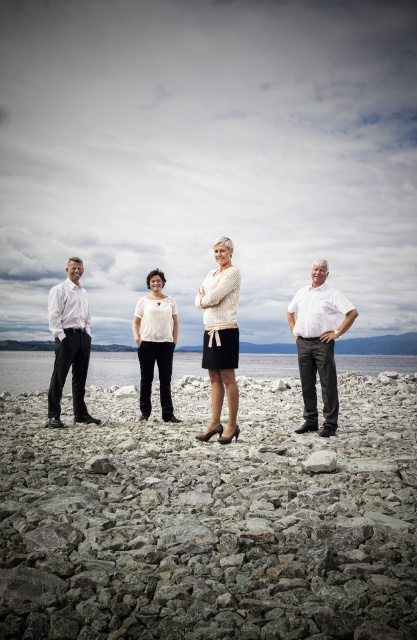
In the scene shown: Between gray gravel at center and white matte shirt at right, which one is positioned higher?

Positioned higher is white matte shirt at right.

Is point (160, 524) closer to viewer compared to point (293, 314)?

That is True.

Identify the location of gray gravel at center. Image resolution: width=417 pixels, height=640 pixels. (211, 518).

Which of these two, matte white shirt at left or gray rock at center, stands shorter?

Standing shorter between the two is gray rock at center.

Locate an element on the screen. The width and height of the screenshot is (417, 640). matte white shirt at left is located at coordinates (68, 342).

This screenshot has width=417, height=640. Describe the element at coordinates (68, 342) in the screenshot. I see `matte white shirt at left` at that location.

This screenshot has height=640, width=417. I want to click on matte white shirt at left, so click(x=68, y=342).

Who is more forward, (203, 433) or (301, 464)?

Point (301, 464) is in front.

Who is taller, white knit sweater at center or gray rock at center?

With more height is white knit sweater at center.

The height and width of the screenshot is (640, 417). Identify the location of white knit sweater at center. (221, 339).